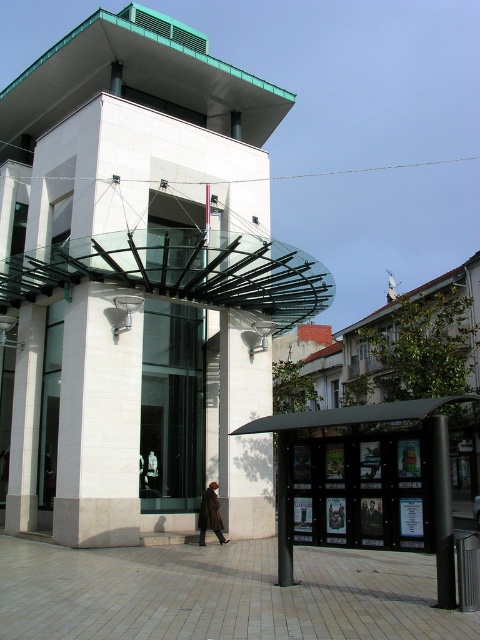
You are standing at the entrance of the building and notice the white stone bell tower at center. Based on its coordinates, can you determine its position relative to the entrance?

The white stone bell tower at center is located at point (x=139, y=284), which means it is positioned slightly to the right and above the entrance area.

You are standing in front of the modern building and see the white polished stone pillar at left and the black metal pole at lower right. Which object is located to the left of the other?

The white polished stone pillar at left is positioned on the left side of black metal pole at lower right.

You are an architect designing a new building and want to ensure that the white stone bell tower at center and the white polished stone pillar at left are proportionate. Which of the two structures has a greater width?

The white stone bell tower at center has a greater width than the white polished stone pillar at left according to the description.